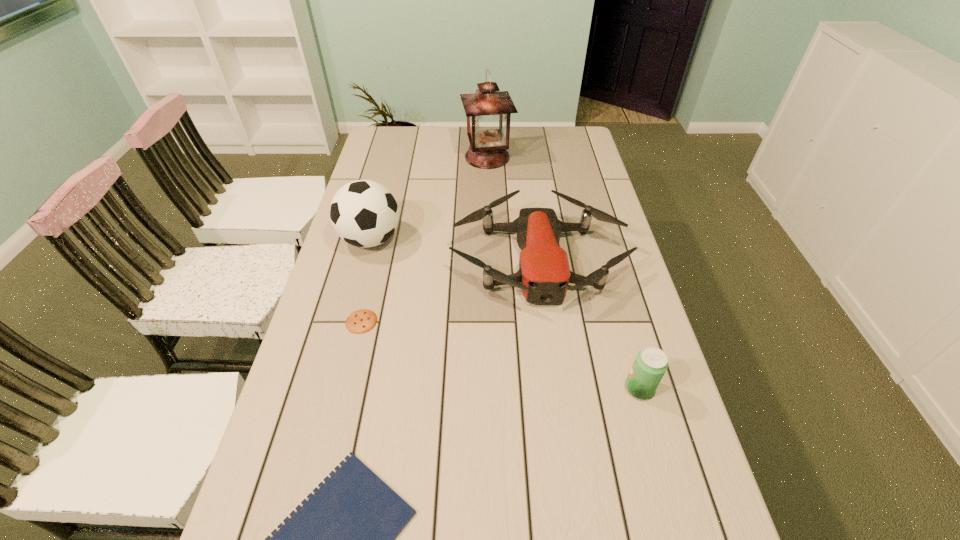
The width and height of the screenshot is (960, 540). What are the coordinates of `free spot at the far right corner of the desktop` in the screenshot? It's located at (563, 149).

Identify the location of unoccupied position between the second nearest object and the drone. This screenshot has width=960, height=540. (588, 324).

What are the coordinates of `unoccupied position between the oil lamp and the soccer ball` in the screenshot? It's located at (429, 198).

Locate an element on the screen. The width and height of the screenshot is (960, 540). vacant area between the fifth shortest object and the cookie is located at coordinates (366, 280).

Locate an element on the screen. This screenshot has height=540, width=960. vacant space that's between the second nearest object and the drone is located at coordinates (588, 324).

You are a GUI agent. You are given a task and a screenshot of the screen. Output one action in this format:
    pyautogui.click(x=<x>, y=<y>)
    Task: Click on the unoccupied area between the fifth farthest object and the drone
    This screenshot has width=960, height=540.
    Given the screenshot: What is the action you would take?
    pyautogui.click(x=588, y=324)

This screenshot has width=960, height=540. Find the location of `free space that is in between the cookie and the soccer ball`. free space that is in between the cookie and the soccer ball is located at coordinates (366, 280).

I want to click on the fourth closest object to the drone, so click(x=488, y=112).

Locate an element on the screen. The width and height of the screenshot is (960, 540). the third closest object relative to the drone is located at coordinates (650, 365).

This screenshot has width=960, height=540. I want to click on blank area in the image that satisfies the following two spatial constraints: 1. on the front side of the second nearest object; 2. on the left side of the cookie, so click(346, 388).